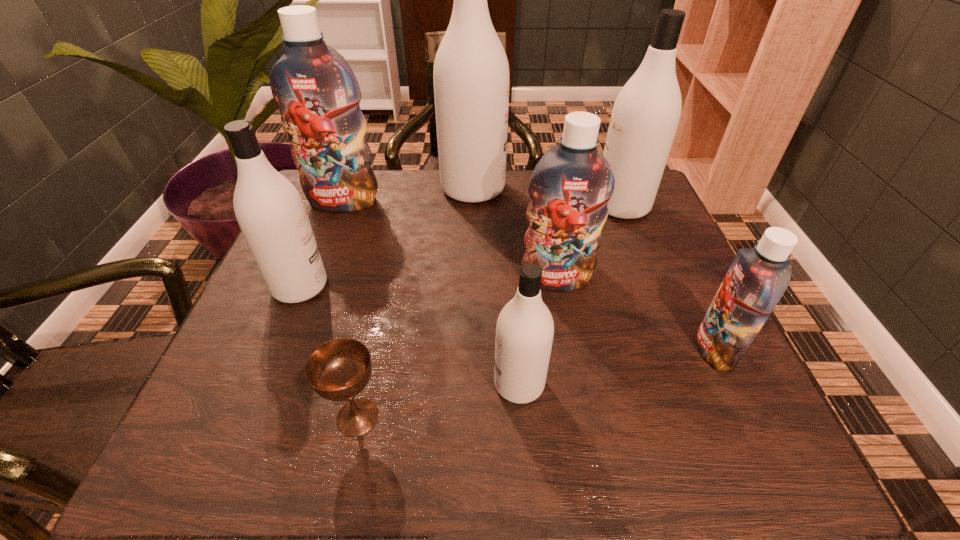
The image size is (960, 540). What are the coordinates of `object that is at the far right corner` in the screenshot? It's located at (645, 116).

Where is `vacant space at the far edge of the desktop`? Image resolution: width=960 pixels, height=540 pixels. vacant space at the far edge of the desktop is located at coordinates tap(409, 192).

Identify the location of vacant space at the near edge of the desktop. This screenshot has width=960, height=540. (513, 452).

Locate an element on the screen. This screenshot has width=960, height=540. free space at the left edge of the desktop is located at coordinates pos(287,409).

You are a GUI agent. You are given a task and a screenshot of the screen. Output one action in this format:
    pyautogui.click(x=<x>, y=<y>)
    Task: Click on the vacant space at the right edge of the desktop
    
    Given the screenshot: What is the action you would take?
    pyautogui.click(x=693, y=346)

In the image, there is a desktop. In order to click on vacant area at the near left corner in this screenshot , I will do `click(279, 455)`.

In the image, there is a desktop. Identify the location of vacant space at the far right corner. This screenshot has width=960, height=540. (667, 220).

This screenshot has height=540, width=960. Identify the location of vacant point located between the rightmost blue shampoo and the third smallest white shampoo. (668, 278).

The height and width of the screenshot is (540, 960). Find the location of `blank region between the nearest blue shampoo and the second nearest blue shampoo`. blank region between the nearest blue shampoo and the second nearest blue shampoo is located at coordinates (636, 314).

Where is `vacant space in between the third biggest white shampoo and the second smallest blue shampoo`? vacant space in between the third biggest white shampoo and the second smallest blue shampoo is located at coordinates (428, 283).